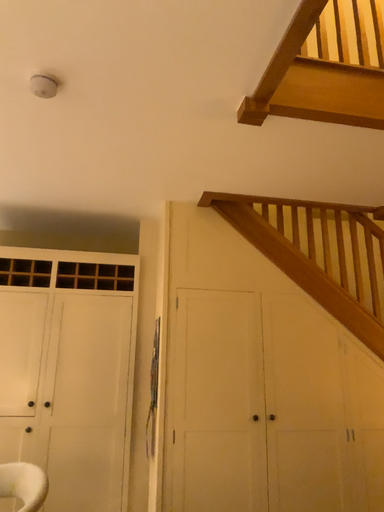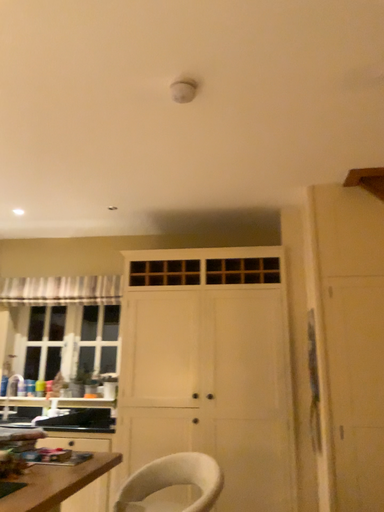
Question: How did the camera likely rotate when shooting the video?

Choices:
 (A) rotated right
 (B) rotated left

Answer: (B)